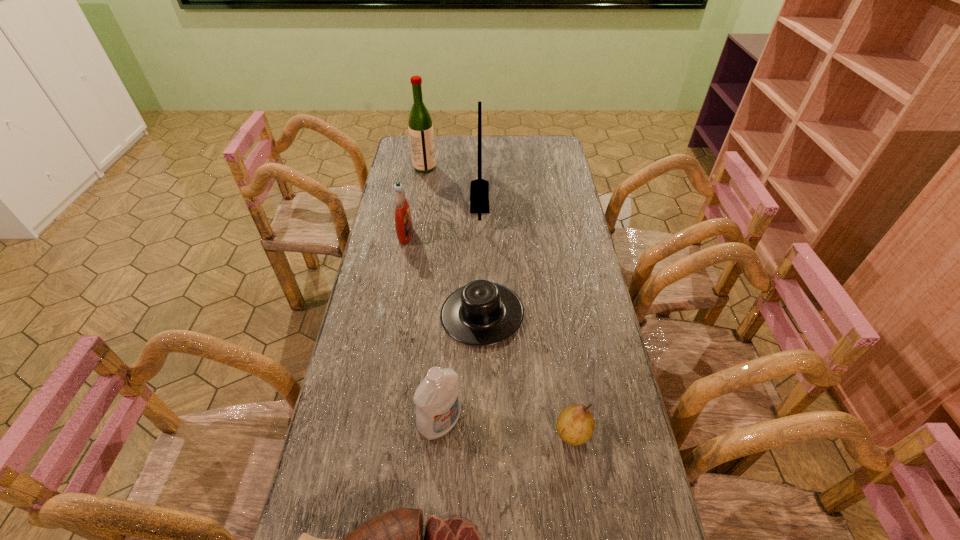
Where is `blank area at the right edge`? The image size is (960, 540). blank area at the right edge is located at coordinates click(622, 397).

Image resolution: width=960 pixels, height=540 pixels. In order to click on free space at the far right corner in this screenshot , I will do `click(564, 152)`.

I want to click on free space between the fourth farthest object and the pear, so click(x=527, y=373).

Identify the location of free space between the liquor and the nearer detergent. The image size is (960, 540). (432, 295).

Where is `vacant space that's between the shortest object and the monitor`? The height and width of the screenshot is (540, 960). vacant space that's between the shortest object and the monitor is located at coordinates (481, 255).

This screenshot has height=540, width=960. What are the coordinates of `vacant area between the right detergent and the rightmost object` in the screenshot? It's located at (506, 428).

Where is `vacant space that is in between the monitor and the farther detergent`? vacant space that is in between the monitor and the farther detergent is located at coordinates (443, 215).

Find the location of a particular element. The image size is (960, 540). free space between the pear and the right detergent is located at coordinates (506, 428).

What are the coordinates of `free space that is in between the right detergent and the shortest object` in the screenshot? It's located at (461, 368).

Identify the location of free space between the sixth shortest object and the rightmost object. This screenshot has height=540, width=960. (526, 315).